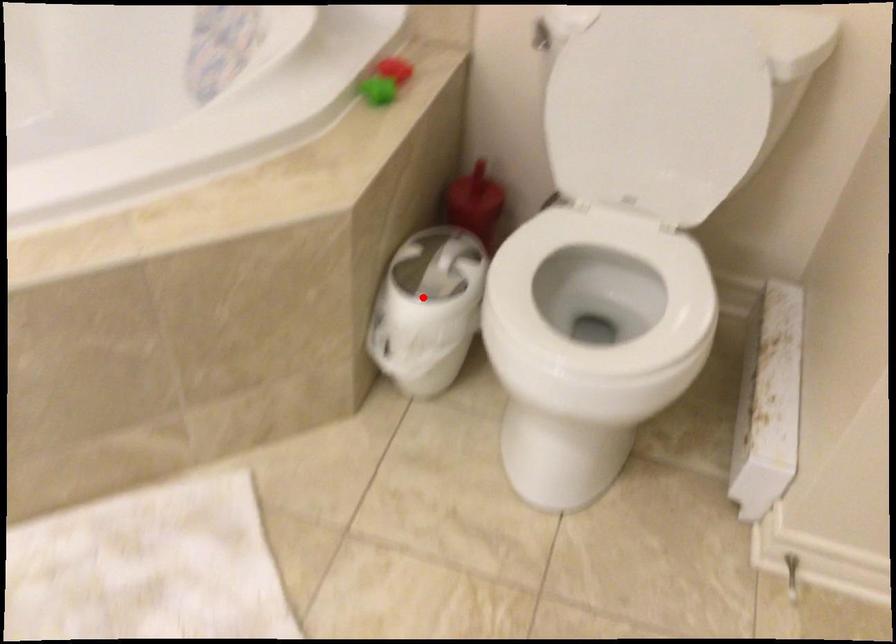
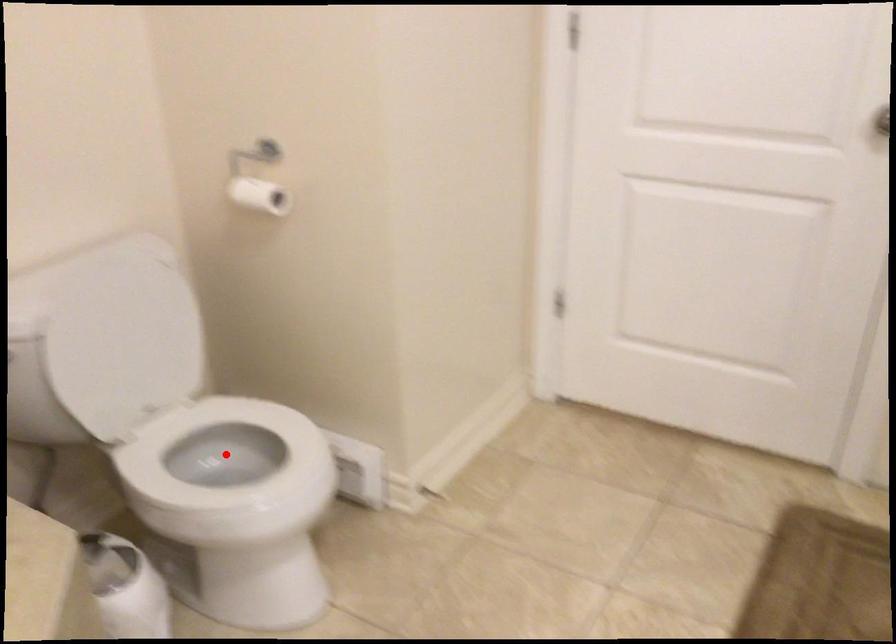
I am providing you with two images of the same scene from different viewpoints. A red point is marked on the first image and another point is marked on the second image. Do the highlighted points in image1 and image2 indicate the same real-world spot?

No